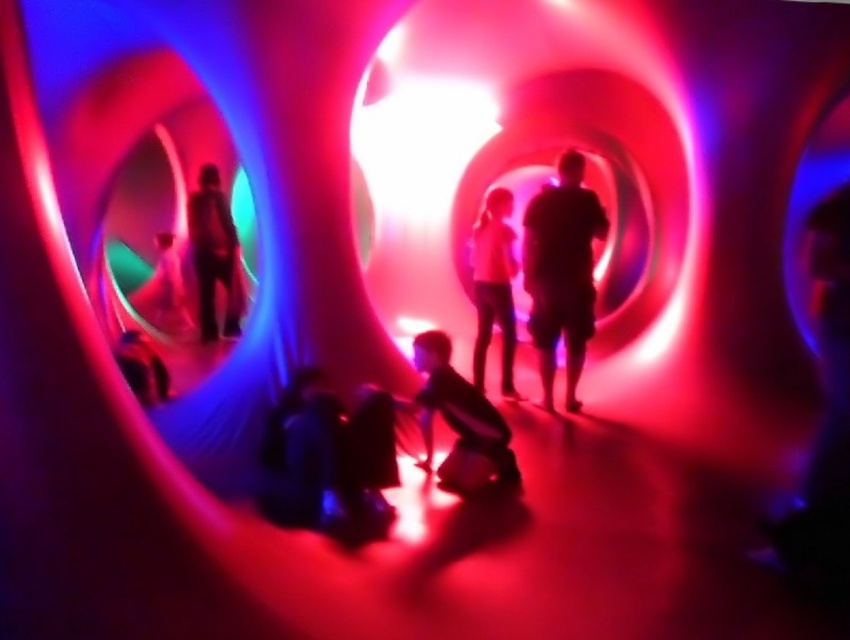
This screenshot has height=640, width=850. In order to click on silhouette human at center in this screenshot , I will do `click(561, 272)`.

Who is taller, silhouette human at center or matte black suit at center?

With more height is silhouette human at center.

Does point (530, 289) lie in front of point (225, 284)?

Yes, it is.

In order to click on silhouette human at center in this screenshot , I will do `click(561, 272)`.

Is pink matte shirt at center above matte black suit at center?

No, pink matte shirt at center is not above matte black suit at center.

The height and width of the screenshot is (640, 850). Find the location of `pink matte shirt at center`. pink matte shirt at center is located at coordinates (493, 285).

Is point (513, 236) positioned behind point (233, 326)?

That is False.

In order to click on pink matte shirt at center in this screenshot , I will do `click(493, 285)`.

From the picture: Can you confirm if dark matte clothing at center is positioned to the left of matte black suit at center?

Incorrect, dark matte clothing at center is not on the left side of matte black suit at center.

Describe the element at coordinates (459, 420) in the screenshot. I see `dark matte clothing at center` at that location.

Image resolution: width=850 pixels, height=640 pixels. What do you see at coordinates (459, 420) in the screenshot?
I see `dark matte clothing at center` at bounding box center [459, 420].

You are a GUI agent. You are given a task and a screenshot of the screen. Output one action in this format:
    pyautogui.click(x=<x>, y=<y>)
    Task: Click on the dark matte clothing at center
    The width and height of the screenshot is (850, 640).
    Given the screenshot: What is the action you would take?
    pyautogui.click(x=459, y=420)